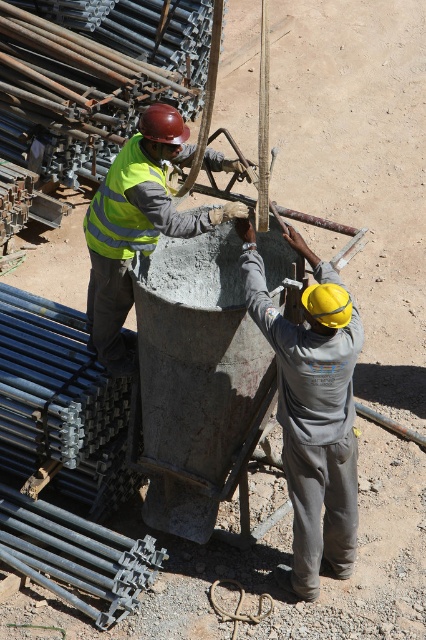
Based on the scene description, can you determine the spatial relationship between the gray matte concrete at center and the reflective yellow vest at center?

The gray matte concrete at center is located to the right of the reflective yellow vest at center.

Based on the scene description, can you determine the position of the gray matte concrete at center relative to the reflective yellow safety vest at center?

The gray matte concrete at center is located below the reflective yellow safety vest at center.

You are a safety inspector at the construction site. You notice two workers wearing yellow vests. One is labeled as the reflective yellow vest at center and the other as the reflective yellow safety vest at center. According to safety regulations, the vest must be at least 40 cm in width to be visible from a distance. Which worker is wearing a vest that meets the visibility requirement?

The reflective yellow vest at center has a larger width than the reflective yellow safety vest at center. Since the vest must be at least 40 cm wide, the reflective yellow vest at center likely meets the visibility requirement if its width exceeds 40 cm. However, without exact measurements, we can only confirm that the reflective yellow vest at center is wider than the other.